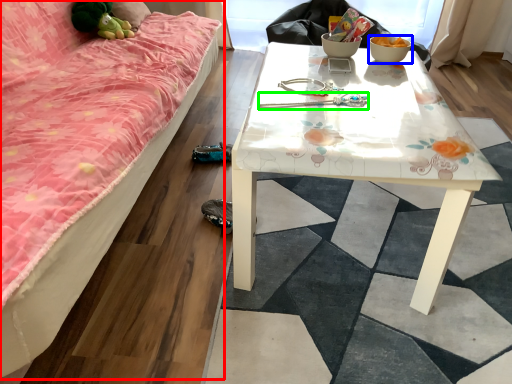
Question: Which object is the farthest from studio couch (highlighted by a red box)? Choose among these: bowl (highlighted by a blue box) or twin (highlighted by a green box).

Choices:
 (A) bowl
 (B) twin

Answer: (A)